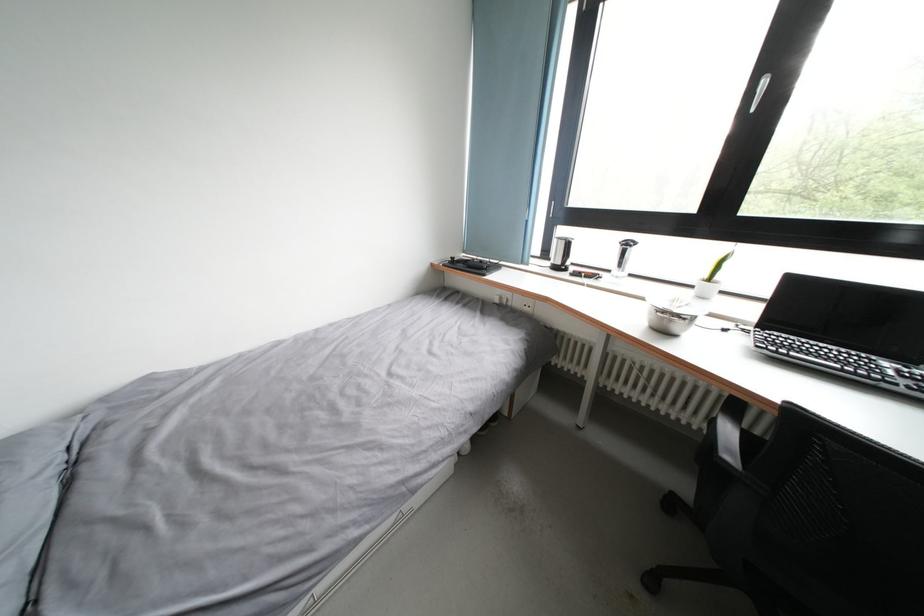
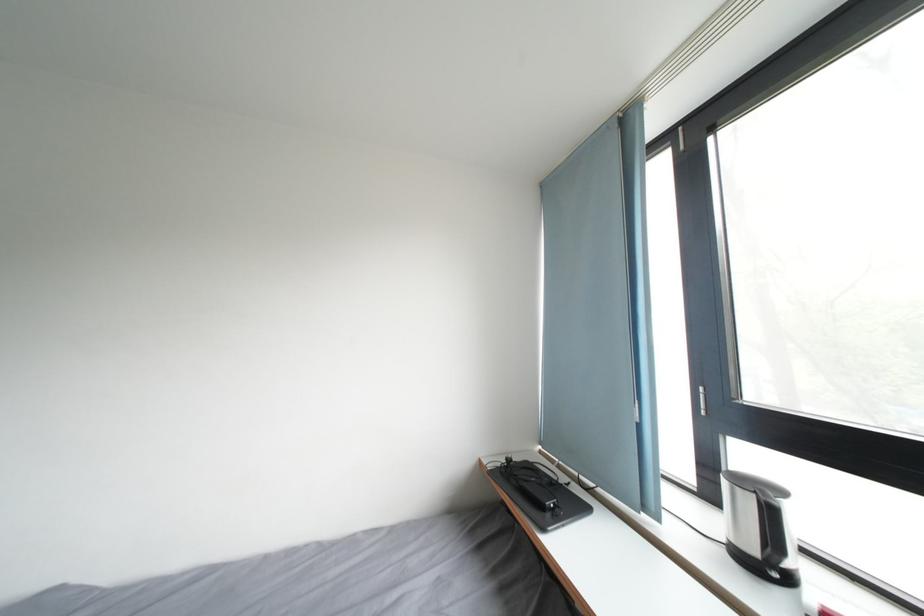
The point at (x=575, y=249) is marked in the first image. Where is the corresponding point in the second image?

(776, 517)